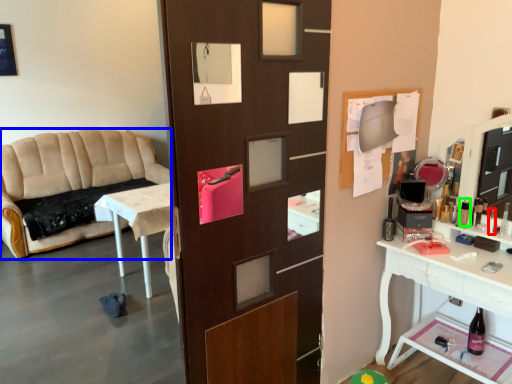
Question: Which object is positioned closest to toiletry (highlighted by a red box)? Select from studio couch (highlighted by a blue box) and toiletry (highlighted by a green box).

Choices:
 (A) studio couch
 (B) toiletry

Answer: (B)